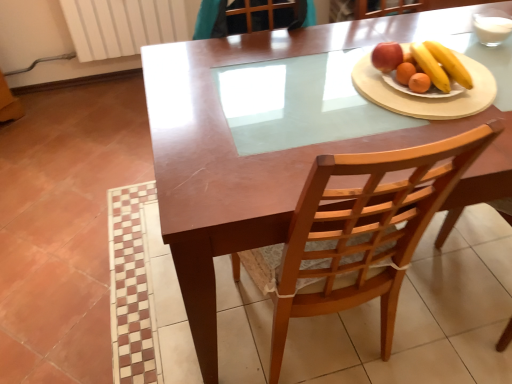
What do you see at coordinates (358, 232) in the screenshot? The width and height of the screenshot is (512, 384). I see `wooden chair at center` at bounding box center [358, 232].

What do you see at coordinates (426, 99) in the screenshot? The image size is (512, 384). I see `white ceramic plate at upper right` at bounding box center [426, 99].

Locate an element on the screen. white ceramic plate at upper right is located at coordinates (426, 99).

Find the location of `wooden chair at center`. wooden chair at center is located at coordinates (358, 232).

Is wooden chair at center closer to camera compared to smooth wooden plate with fruits at right?

Yes.

Is point (298, 212) closer or farther from the camera than point (438, 83)?

Point (298, 212) appears to be closer to the viewer than point (438, 83).

Which of these two, wooden chair at center or smooth wooden plate with fruits at right, is thinner?

With smaller width is smooth wooden plate with fruits at right.

Is wooden chair at center to the left of smooth wooden plate with fruits at right from the viewer's perspective?

Yes, wooden chair at center is to the left of smooth wooden plate with fruits at right.

Is wooden chair at center facing away from white ceramic plate at upper right?

wooden chair at center does not have its back to white ceramic plate at upper right.

Considering the sizes of objects wooden chair at center and white ceramic plate at upper right in the image provided, who is wider, wooden chair at center or white ceramic plate at upper right?

Wider between the two is wooden chair at center.

From a real-world perspective, is wooden chair at center on white ceramic plate at upper right?

Actually, wooden chair at center is physically below white ceramic plate at upper right in the real world.

Is smooth wooden plate with fruits at right completely or partially outside of wooden chair at center?

Absolutely, smooth wooden plate with fruits at right is external to wooden chair at center.

Who is smaller, smooth wooden plate with fruits at right or wooden chair at center?

With smaller size is smooth wooden plate with fruits at right.

Could you tell me if smooth wooden plate with fruits at right is turned towards wooden chair at center?

No.

From the picture: Is smooth wooden plate with fruits at right to the right of wooden chair at center from the viewer's perspective?

Correct, you'll find smooth wooden plate with fruits at right to the right of wooden chair at center.

Which of these two, white ceramic plate at upper right or wooden chair at center, is wider?

wooden chair at center is wider.

Can you confirm if white ceramic plate at upper right is taller than wooden chair at center?

Incorrect, the height of white ceramic plate at upper right is not larger of that of wooden chair at center.

Between white ceramic plate at upper right and wooden chair at center, which one is positioned in front?

wooden chair at center is more forward.

Consider the image. From a real-world perspective, who is located higher, white ceramic plate at upper right or wooden chair at center?

In real-world perspective, white ceramic plate at upper right is above.

From a real-world perspective, is smooth wooden plate with fruits at right positioned under white ceramic plate at upper right based on gravity?

No.

Which object is closer to the camera taking this photo, smooth wooden plate with fruits at right or white ceramic plate at upper right?

white ceramic plate at upper right is in front.

Which object is positioned more to the right, smooth wooden plate with fruits at right or white ceramic plate at upper right?

smooth wooden plate with fruits at right.

In the image, is white ceramic plate at upper right positioned in front of or behind smooth wooden plate with fruits at right?

Visually, white ceramic plate at upper right is located in front of smooth wooden plate with fruits at right.

Is point (400, 98) behind point (436, 55)?

No, it is in front of (436, 55).

Is white ceramic plate at upper right with smooth wooden plate with fruits at right?

Yes, white ceramic plate at upper right is right next to smooth wooden plate with fruits at right and making contact.

The height and width of the screenshot is (384, 512). What are the coordinates of `fruit dish on the right of wooden chair at center` in the screenshot? It's located at coord(423,62).

Image resolution: width=512 pixels, height=384 pixels. What are the coordinates of `chair that appears on the left of white ceramic plate at upper right` in the screenshot? It's located at (358, 232).

Which object lies nearer to the anchor point white ceramic plate at upper right, wooden chair at center or smooth wooden plate with fruits at right?

The object closer to white ceramic plate at upper right is smooth wooden plate with fruits at right.

Considering their positions, is smooth wooden plate with fruits at right positioned closer to white ceramic plate at upper right than wooden chair at center?

The object closer to white ceramic plate at upper right is smooth wooden plate with fruits at right.

Looking at this image, which object lies further to the anchor point smooth wooden plate with fruits at right, wooden chair at center or white ceramic plate at upper right?

wooden chair at center.

Considering their positions, is white ceramic plate at upper right positioned closer to wooden chair at center than smooth wooden plate with fruits at right?

white ceramic plate at upper right is closer to wooden chair at center.

From the image, which object appears to be farther from wooden chair at center, smooth wooden plate with fruits at right or white ceramic plate at upper right?

smooth wooden plate with fruits at right lies further to wooden chair at center than the other object.

Based on the photo, estimate the real-world distances between objects in this image. Which object is closer to smooth wooden plate with fruits at right, white ceramic plate at upper right or wooden chair at center?

Based on the image, white ceramic plate at upper right appears to be nearer to smooth wooden plate with fruits at right.

The image size is (512, 384). I want to click on platter between wooden chair at center and smooth wooden plate with fruits at right along the z-axis, so click(426, 99).